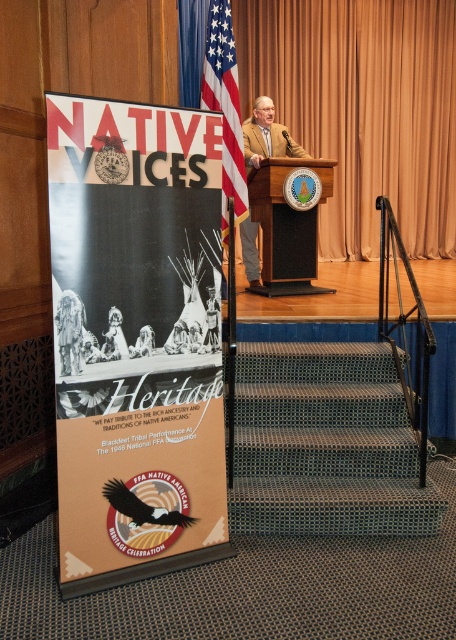
Who is lower down, matte cardboard poster at left or american flag at center?

matte cardboard poster at left is below.

Who is more distant from viewer, (x=181, y=160) or (x=237, y=109)?

Positioned behind is point (x=237, y=109).

Locate an element on the screen. This screenshot has width=456, height=640. matte cardboard poster at left is located at coordinates (134, 339).

The image size is (456, 640). What are the coordinates of `matte cardboard poster at left` in the screenshot? It's located at (134, 339).

Find the location of a particular element. This screenshot has width=456, height=640. matte cardboard poster at left is located at coordinates (134, 339).

Is point (63, 557) behind point (316, 424)?

No, (63, 557) is closer to viewer.

At what (x,y) coordinates should I click in order to perform the action: click on matte cardboard poster at left. Please return your answer as a coordinate pair (x, y). Looking at the image, I should click on (134, 339).

Measure the distance between matte cardboard poster at left and tan leather jacket at center.

They are 2.90 meters apart.

Between matte cardboard poster at left and tan leather jacket at center, which one has less height?

With less height is tan leather jacket at center.

Between point (198, 524) and point (244, 257), which one is positioned in front?

Point (198, 524)

I want to click on matte cardboard poster at left, so click(x=134, y=339).